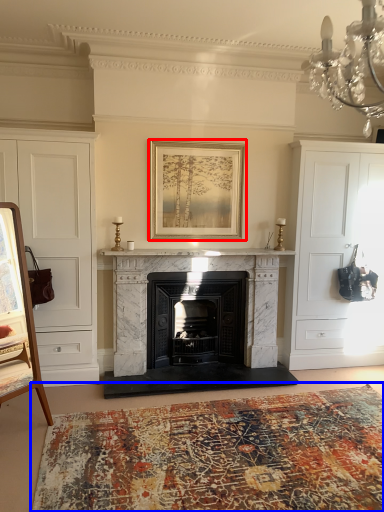
Question: Which point is further to the camera, picture frame (highlighted by a red box) or plain (highlighted by a blue box)?

Choices:
 (A) picture frame
 (B) plain

Answer: (A)